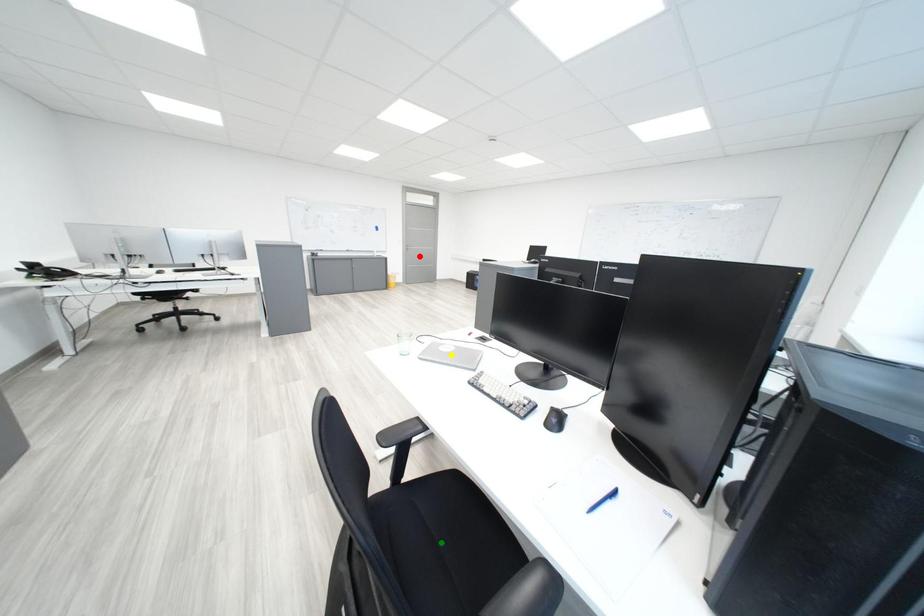
Order these from farthest to nearest:
1. green point
2. red point
3. yellow point

red point, yellow point, green point